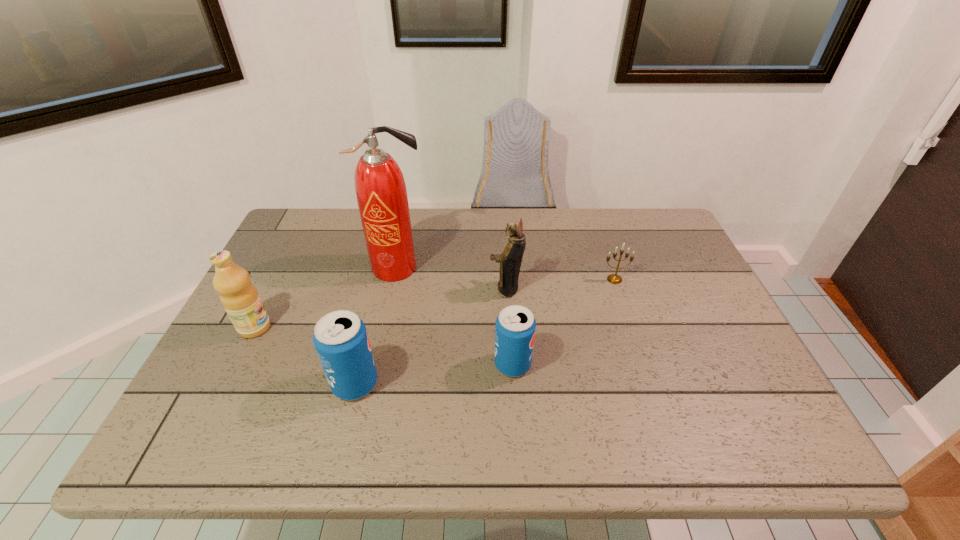
Locate an element on the screen. The width and height of the screenshot is (960, 540). the taller soda can is located at coordinates (340, 338).

Where is `the left soda can`? Image resolution: width=960 pixels, height=540 pixels. the left soda can is located at coordinates (340, 338).

Find the location of `the shorter soda can`. the shorter soda can is located at coordinates (x=515, y=326).

The height and width of the screenshot is (540, 960). Find the location of `the right soda can`. the right soda can is located at coordinates (515, 326).

You are a GUI agent. You are given a task and a screenshot of the screen. Output one action in this format:
    pyautogui.click(x=<x>, y=<y>)
    Task: Click on the fire extinguisher
    The height and width of the screenshot is (540, 960).
    Given the screenshot: What is the action you would take?
    pyautogui.click(x=380, y=188)

This screenshot has height=540, width=960. I want to click on candelabrum, so click(612, 278).

Where is `the shortest object`? The width and height of the screenshot is (960, 540). the shortest object is located at coordinates pyautogui.click(x=612, y=278).

This screenshot has width=960, height=540. I want to click on the third nearest object, so (x=240, y=298).

Image resolution: width=960 pixels, height=540 pixels. Identify the location of the leftmost object. (240, 298).

Locate an element on the screen. The image size is (960, 540). figurine is located at coordinates (510, 260).